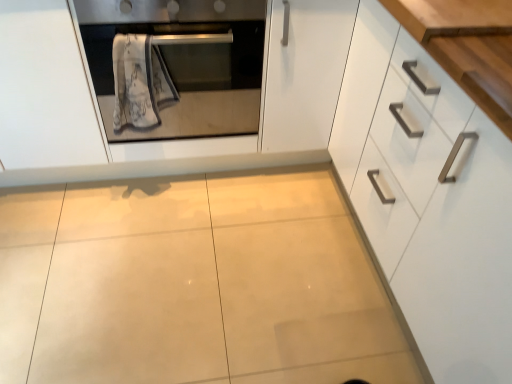
The width and height of the screenshot is (512, 384). In order to click on vacant space underneath white textured towel at center (from a real-world perspective) in this screenshot , I will do `click(163, 198)`.